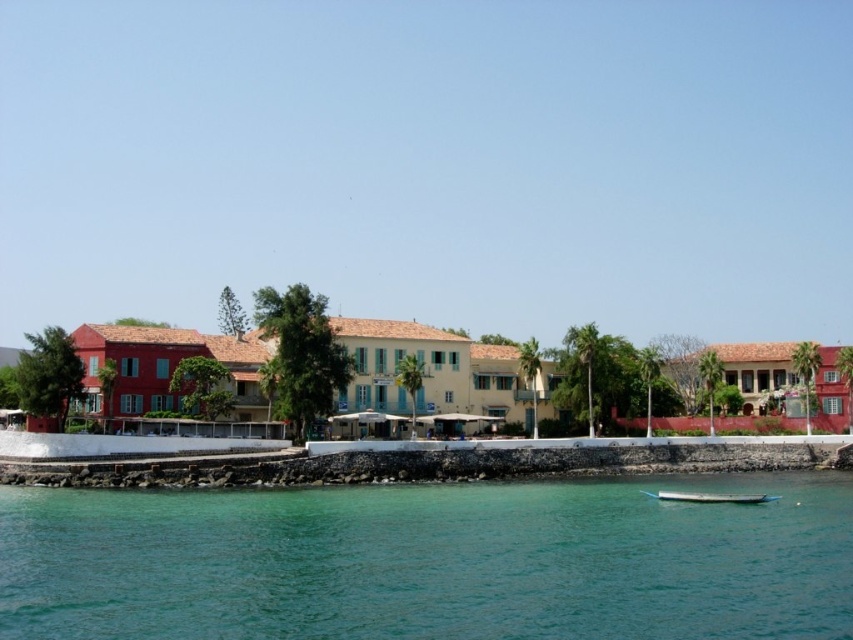
Which is above, clear water at lower center or wooden boat at lower center?

Positioned higher is clear water at lower center.

Identify the location of clear water at lower center. The image size is (853, 640). coord(431,561).